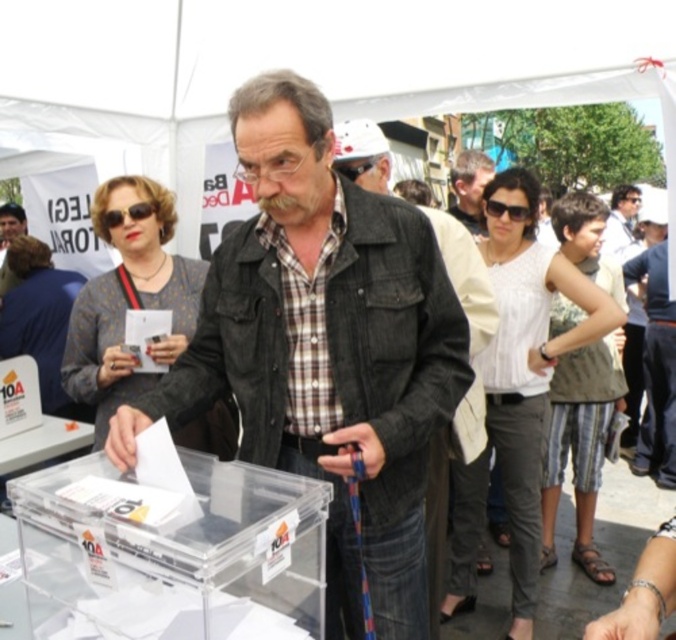
Question: Does denim jacket at center have a larger size compared to gray fabric shirt at center?

Choices:
 (A) no
 (B) yes

Answer: (B)

Question: Does denim jacket at center appear over gray fabric shirt at center?

Choices:
 (A) no
 (B) yes

Answer: (A)

Question: Which point is closer to the camera?

Choices:
 (A) gray fabric shirt at center
 (B) denim jacket at center

Answer: (B)

Question: Which object appears closest to the camera in this image?

Choices:
 (A) denim jacket at center
 (B) gray fabric shirt at center

Answer: (A)

Question: Does denim jacket at center come behind gray fabric shirt at center?

Choices:
 (A) no
 (B) yes

Answer: (A)